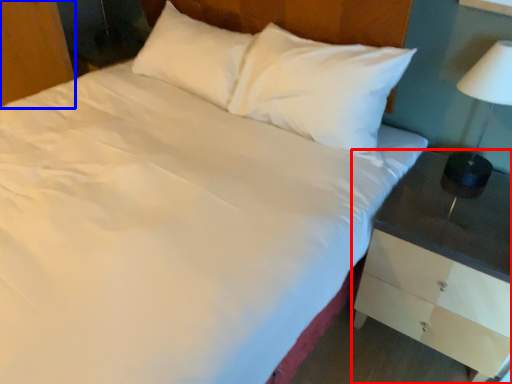
Question: Which point is closer to the camera, nightstand (highlighted by a red box) or dresser (highlighted by a blue box)?

Choices:
 (A) nightstand
 (B) dresser

Answer: (A)